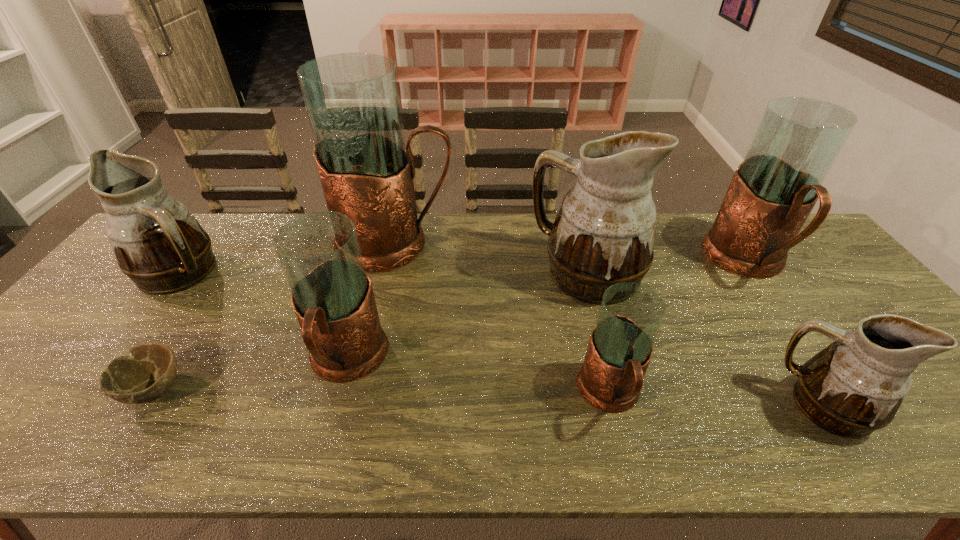
Where is `vacant space located from the spout of the nearest brown pitcher`? This screenshot has height=540, width=960. vacant space located from the spout of the nearest brown pitcher is located at coordinates (699, 406).

I want to click on vacant area located from the spout of the nearest brown pitcher, so click(x=735, y=406).

Find the location of a particular element. The image size is (960, 540). vacant area situated on the right of the bowl is located at coordinates (343, 388).

The image size is (960, 540). What are the coordinates of `object at the left edge` in the screenshot? It's located at (158, 243).

This screenshot has width=960, height=540. What are the coordinates of `object that is at the right edge` in the screenshot? It's located at (773, 191).

Where is `object present at the far left corner`? Image resolution: width=960 pixels, height=540 pixels. object present at the far left corner is located at coordinates (158, 243).

Image resolution: width=960 pixels, height=540 pixels. Find the location of `object that is at the far right corner`. object that is at the far right corner is located at coordinates (773, 191).

I want to click on vacant space at the far edge, so click(x=489, y=222).

In order to click on vacant area at the near edge in this screenshot , I will do `click(505, 428)`.

Identify the location of vacant region at the right edge of the desktop. (803, 281).